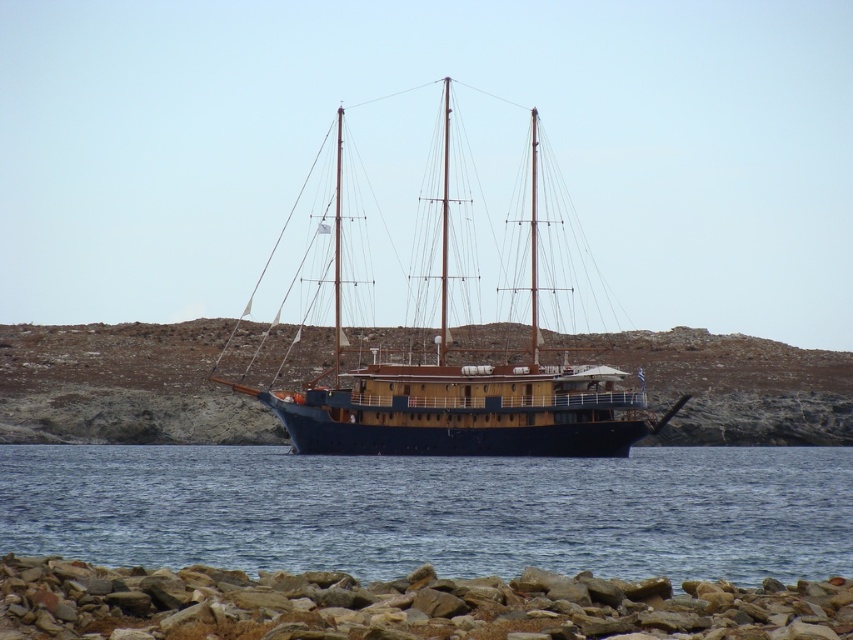
You are standing on the rocky beach and want to reach the ship anchored in the water. Given the coordinates of the blue water at center, can you determine if the ship is located in the calm waters ahead of you?

The blue water at center is located at coordinates point (x=434, y=509), so the ship is anchored in the calm waters ahead of you.

You are an observer on the rocky beach. You see the blue water at center and the blue wooden sailboat at center. Which one takes up more space in the image?

The blue wooden sailboat at center takes up more space in the image than the blue water at center, as the blue water at center has a smaller size compared to the blue wooden sailboat at center.

You are standing on the rocky beach in the foreground of the scene and want to reach the ship anchored in the calm waters. Based on the 2D coordinates provided, is the blue water at center directly in front of you or to one side when facing the ship?

The blue water at center is located at point (x=434, y=509) in 2D coordinates, which places it directly in front of you when facing the ship.